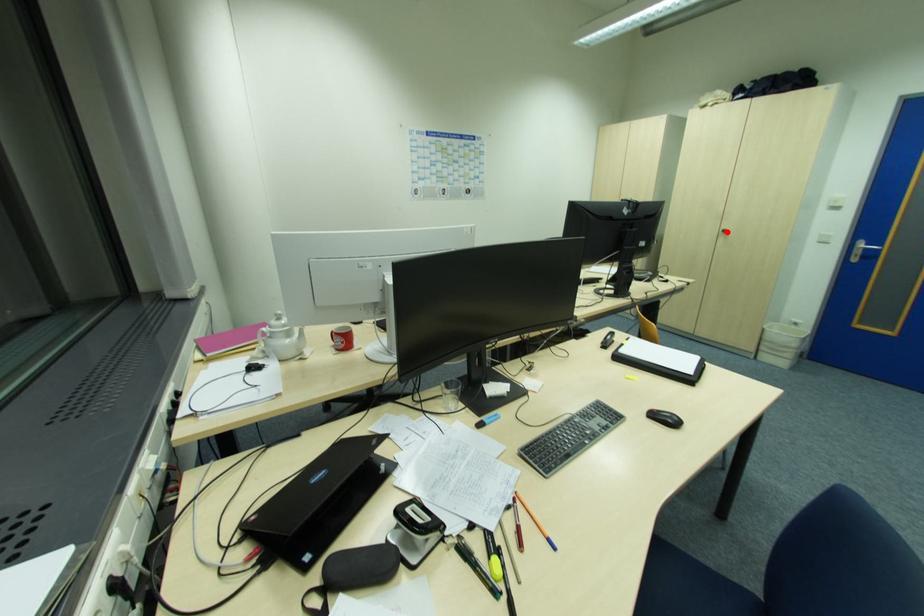
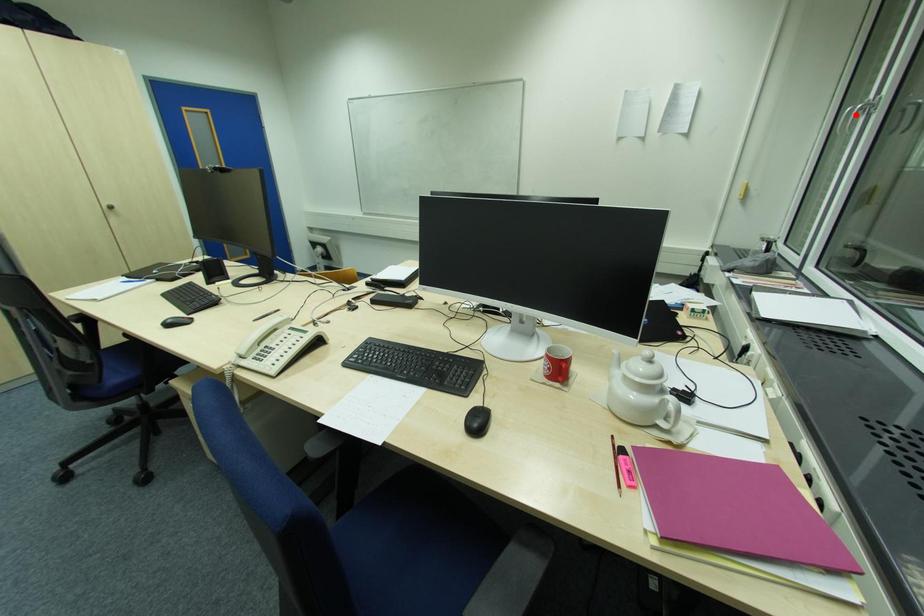
I am providing you with two images of the same scene from different viewpoints. A red point is marked on the first image and another point is marked on the second image. Is the red point in image1 aligned with the point shown in image2?

No